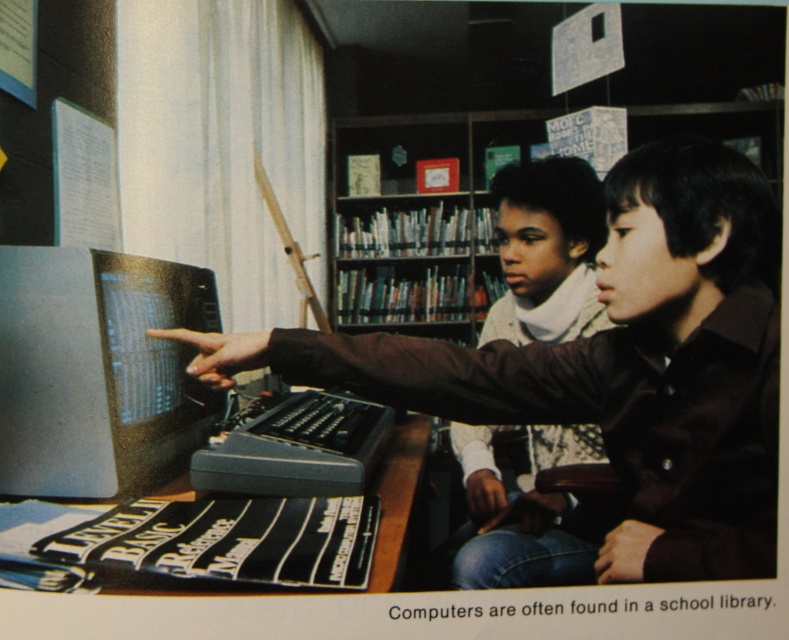
Can you confirm if matte black computer at center is shorter than matte black monitor at center?

No.

Who is more distant from viewer, (x=716, y=346) or (x=178, y=301)?

The point (x=178, y=301) is more distant.

Find the location of a particular element. Image resolution: width=789 pixels, height=640 pixels. matte black computer at center is located at coordinates (610, 381).

At what (x,y) coordinates should I click in order to perform the action: click on matte black computer at center. Please return your answer as a coordinate pair (x, y). The height and width of the screenshot is (640, 789). Looking at the image, I should click on (610, 381).

Does matte black computer at center appear on the right side of white knit sweater at center?

In fact, matte black computer at center is to the left of white knit sweater at center.

Which is more to the left, matte black computer at center or white knit sweater at center?

matte black computer at center

This screenshot has width=789, height=640. I want to click on matte black computer at center, so click(x=610, y=381).

Locate an element on the screen. The width and height of the screenshot is (789, 640). matte black computer at center is located at coordinates (610, 381).

Does matte black monitor at center appear under white knit sweater at center?

Actually, matte black monitor at center is above white knit sweater at center.

Which is below, matte black monitor at center or white knit sweater at center?

white knit sweater at center

Does point (94, 436) come closer to viewer compared to point (597, 458)?

Yes, it is.

Image resolution: width=789 pixels, height=640 pixels. Identify the location of matte black monitor at center. (96, 371).